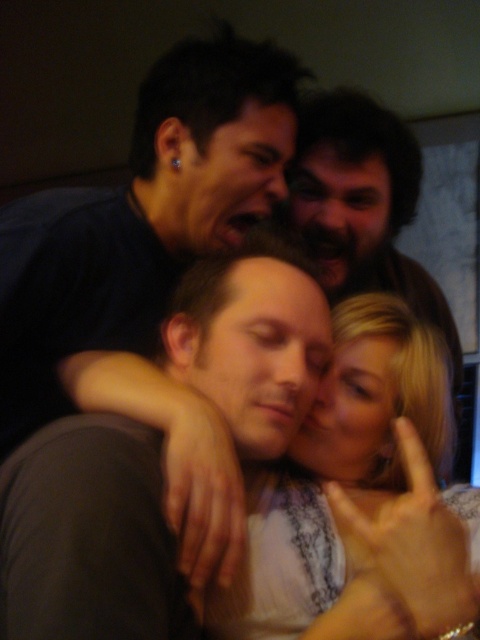
Question: Which point appears farthest from the camera in this image?

Choices:
 (A) (276, 580)
 (B) (162, 198)

Answer: (B)

Question: Can you confirm if matte black shirt at upper left is wider than blonde hair at center?

Choices:
 (A) no
 (B) yes

Answer: (B)

Question: Which is farther from the bearded man at upper center?

Choices:
 (A) blonde hair at center
 (B) matte black shirt at upper left

Answer: (A)

Question: Considering the relative positions of matte black shirt at upper left and blonde hair at center in the image provided, where is matte black shirt at upper left located with respect to blonde hair at center?

Choices:
 (A) above
 (B) below

Answer: (A)

Question: Does blonde hair at center have a greater width compared to bearded man at upper center?

Choices:
 (A) yes
 (B) no

Answer: (B)

Question: Which of the following is the closest to the observer?

Choices:
 (A) pyautogui.click(x=81, y=328)
 (B) pyautogui.click(x=396, y=317)

Answer: (B)